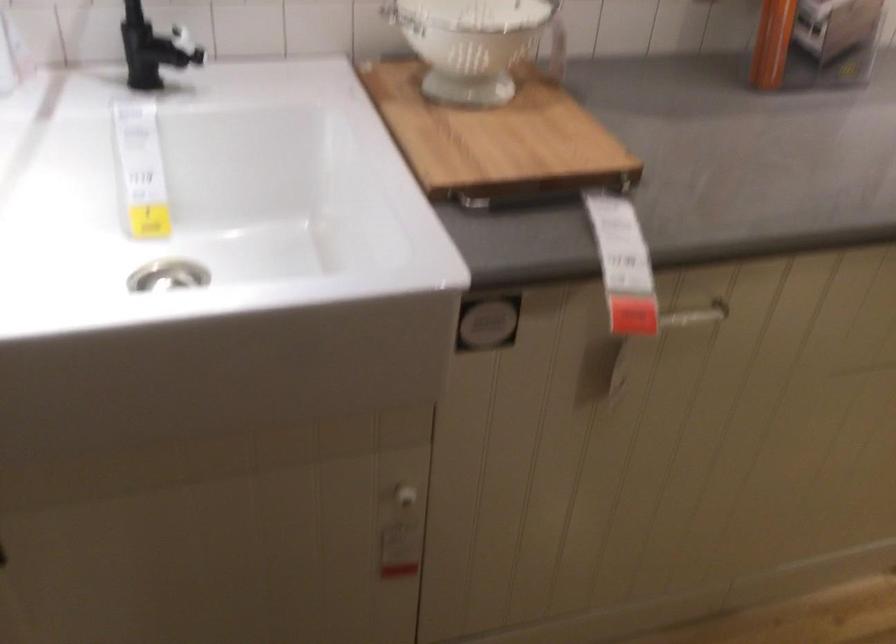
First-person continuous shooting, in which direction is the camera rotating?

The rotation direction of the camera is left-up.